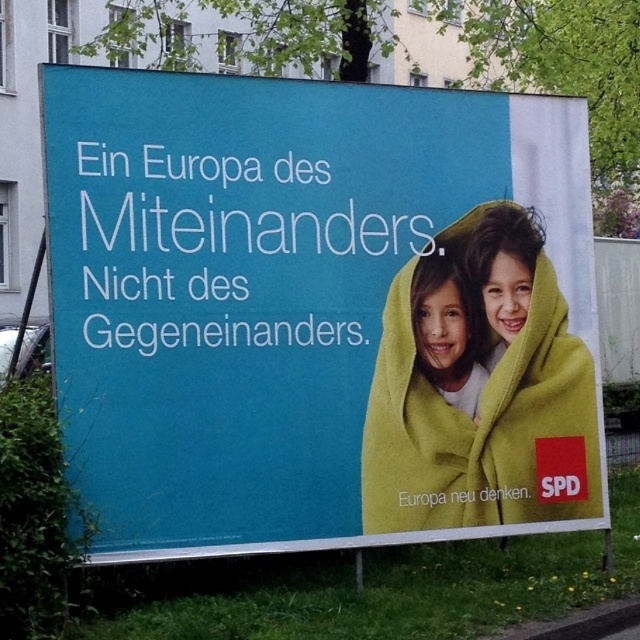
Question: Is matte yellow blanket at center further to camera compared to smooth yellow blanket at center?

Choices:
 (A) no
 (B) yes

Answer: (A)

Question: Where is matte yellow blanket at center located in relation to green fleece blanket at right in the image?

Choices:
 (A) below
 (B) above

Answer: (B)

Question: Which object is closer to the camera taking this photo?

Choices:
 (A) smooth yellow blanket at center
 (B) matte yellow blanket at center

Answer: (B)

Question: Is green fleece blanket at right to the right of smooth yellow blanket at center from the viewer's perspective?

Choices:
 (A) yes
 (B) no

Answer: (A)

Question: Which of the following is the farthest from the observer?

Choices:
 (A) smooth yellow blanket at center
 (B) matte yellow blanket at center
 (C) green fleece blanket at right

Answer: (A)

Question: Which point is closer to the camera taking this photo?

Choices:
 (A) (481, 212)
 (B) (458, 356)
 (C) (51, 236)

Answer: (C)